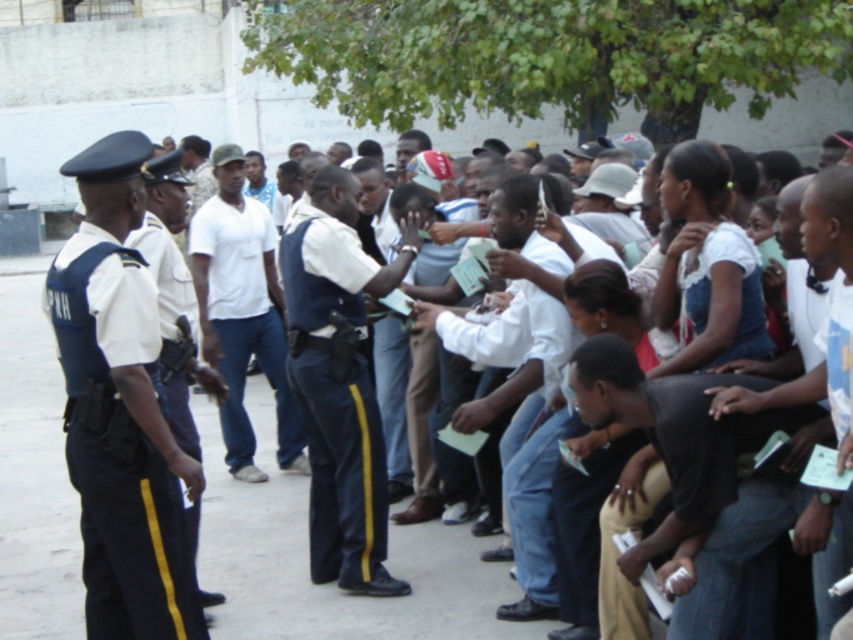
Which is above, dark blue fabric uniform at left or white matte shirt at center?

Positioned higher is white matte shirt at center.

Is dark blue fabric uniform at left to the right of white matte shirt at center from the viewer's perspective?

In fact, dark blue fabric uniform at left is to the left of white matte shirt at center.

Image resolution: width=853 pixels, height=640 pixels. Describe the element at coordinates (120, 444) in the screenshot. I see `dark blue fabric uniform at left` at that location.

I want to click on dark blue fabric uniform at left, so click(x=120, y=444).

Is point (56, 291) less distant than point (225, 461)?

Yes.

Is dark blue fabric uniform at left behind white cotton shirt at center?

No.

At what (x,y) coordinates should I click in order to perform the action: click on dark blue fabric uniform at left. Please return your answer as a coordinate pair (x, y). The height and width of the screenshot is (640, 853). Looking at the image, I should click on (120, 444).

Between point (526, 381) and point (149, 218), which one is positioned behind?

The point (149, 218) is more distant.

Which is more to the right, white matte shirt at center or dark blue uniform at center?

Positioned to the right is white matte shirt at center.

Image resolution: width=853 pixels, height=640 pixels. In order to click on white matte shirt at center in this screenshot , I will do `click(509, 310)`.